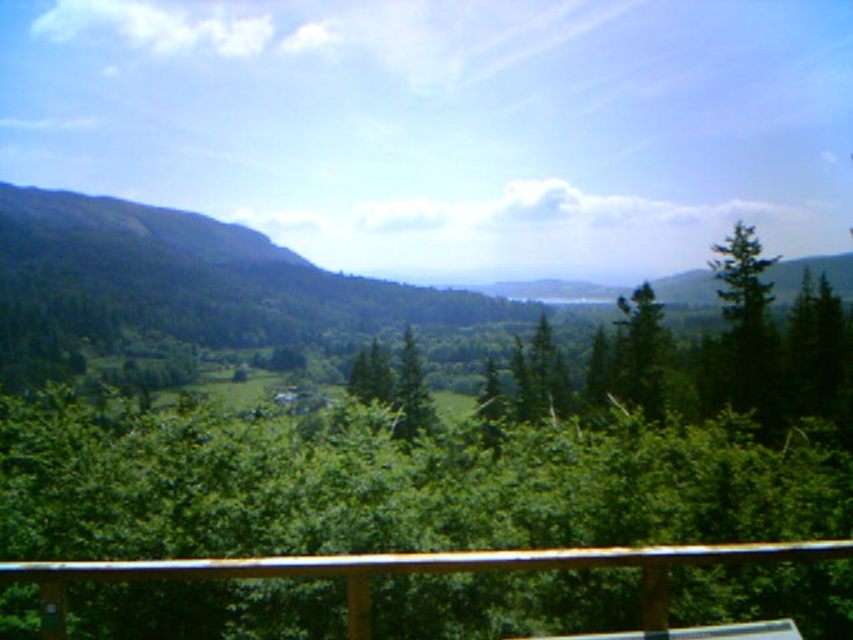
Question: Can you confirm if brown wooden rail at lower center is wider than green matte tree at right?

Choices:
 (A) yes
 (B) no

Answer: (B)

Question: Estimate the real-world distances between objects in this image. Which object is closer to the green matte tree at center?

Choices:
 (A) brown wooden rail at lower center
 (B) green matte tree at upper right
 (C) green matte tree at right

Answer: (B)

Question: Considering the real-world distances, which object is closest to the green matte tree at right?

Choices:
 (A) green matte tree at upper right
 (B) brown wooden rail at lower center

Answer: (A)

Question: Among these objects, which one is farthest from the camera?

Choices:
 (A) brown wooden rail at lower center
 (B) green matte tree at right
 (C) green matte tree at upper right

Answer: (C)

Question: Is brown wooden rail at lower center above green matte tree at right?

Choices:
 (A) yes
 (B) no

Answer: (B)

Question: Is brown wooden rail at lower center positioned behind green matte tree at center?

Choices:
 (A) no
 (B) yes

Answer: (A)